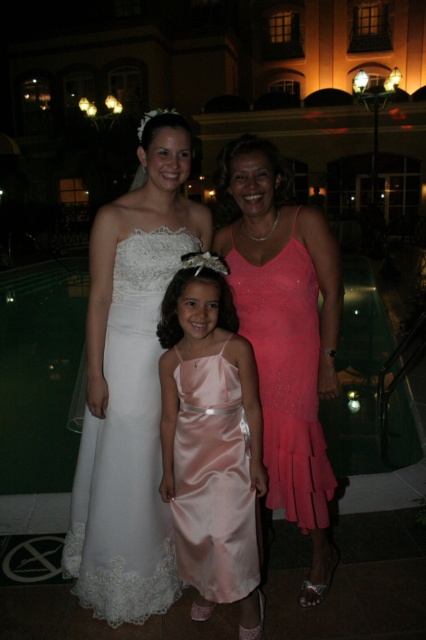
Question: Considering the relative positions of satin dress at center and shiny pink dress at center in the image provided, where is satin dress at center located with respect to shiny pink dress at center?

Choices:
 (A) below
 (B) above

Answer: (A)

Question: Is white satin dress at center above satin dress at center?

Choices:
 (A) yes
 (B) no

Answer: (A)

Question: Which point is closer to the camera taking this photo?

Choices:
 (A) (164, 403)
 (B) (287, 372)
 (C) (94, 288)

Answer: (A)

Question: Does white satin dress at center come behind satin dress at center?

Choices:
 (A) yes
 (B) no

Answer: (A)

Question: Estimate the real-world distances between objects in this image. Which object is farther from the satin dress at center?

Choices:
 (A) white satin dress at center
 (B) shiny pink dress at center

Answer: (B)

Question: Which point appears closest to the camera in this image?

Choices:
 (A) (311, 305)
 (B) (187, 445)

Answer: (B)